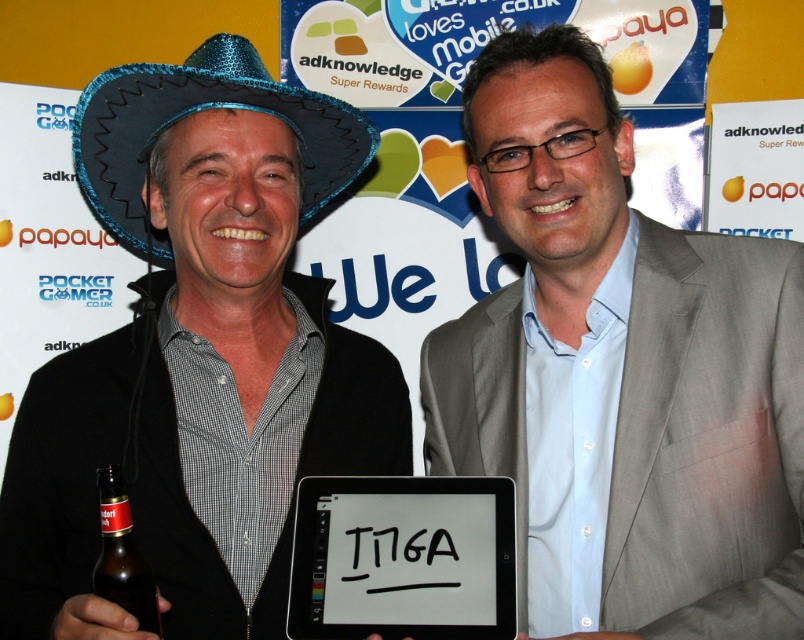
Between light gray suit at center and shiny blue hat at center, which one is positioned lower?

shiny blue hat at center is lower down.

Can you confirm if light gray suit at center is bigger than shiny blue hat at center?

No.

Does point (606, 609) come closer to viewer compared to point (286, 288)?

That is True.

Find the location of a particular element. This screenshot has height=640, width=804. light gray suit at center is located at coordinates (621, 374).

Does light gray suit at center have a greater height compared to black matte tablet at center?

Indeed, light gray suit at center has a greater height compared to black matte tablet at center.

This screenshot has height=640, width=804. What do you see at coordinates (621, 374) in the screenshot? I see `light gray suit at center` at bounding box center [621, 374].

Image resolution: width=804 pixels, height=640 pixels. I want to click on light gray suit at center, so click(x=621, y=374).

Who is positioned more to the left, black matte tablet at center or brown glass bottle at lower left?

brown glass bottle at lower left

Can you confirm if black matte tablet at center is positioned to the right of brown glass bottle at lower left?

Correct, you'll find black matte tablet at center to the right of brown glass bottle at lower left.

Is point (363, 480) farther from camera compared to point (124, 582)?

Yes, point (363, 480) is behind point (124, 582).

Find the location of `black matte tablet at center`. black matte tablet at center is located at coordinates 402,557.